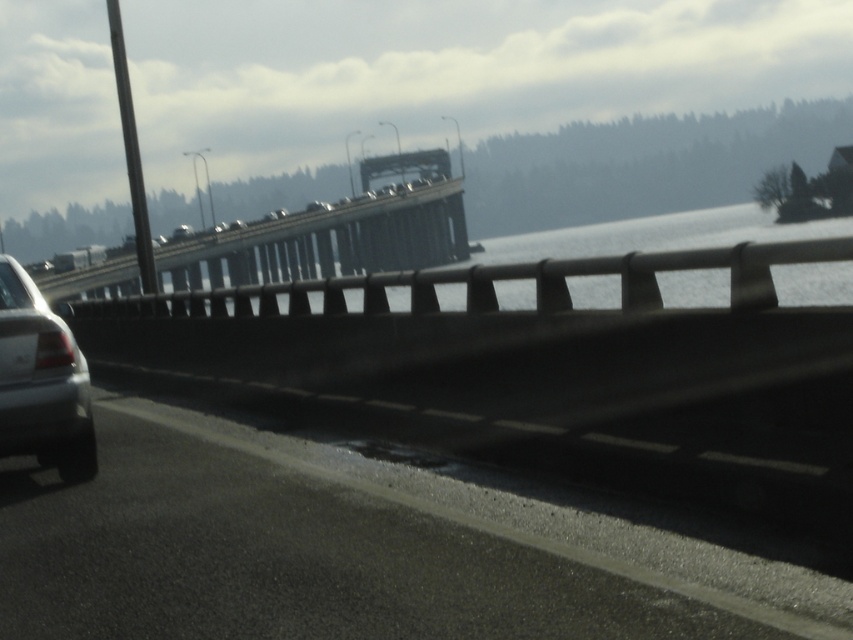
You are a drone operator tasked with capturing aerial footage of the metallic gray bridge at upper center and the satin silver sedan at left. Your drone has a maximum range of 100 meters. Can you capture both subjects in a single flight without exceeding the drone range limit?

The metallic gray bridge at upper center and the satin silver sedan at left are 101.22 meters apart from each other, which exceeds the drone range limit of 100 meters. Therefore, you cannot capture both subjects in a single flight without exceeding the range limit.

You are a passenger in the vehicle and want to know the exact location of the metallic gray bridge at upper center. What coordinates should you report to the driver?

The metallic gray bridge at upper center is located at coordinates point (334, 234).

Looking at this image, you are driving a truck that is 25 meters long. You see the metallic gray bridge at upper center ahead. Can you safely pass under it without hitting the bridge?

The metallic gray bridge at upper center is 24.94 meters from viewer. Since your truck is 25 meters long, it is slightly longer than the available space. Therefore, you cannot safely pass under the bridge without hitting it.